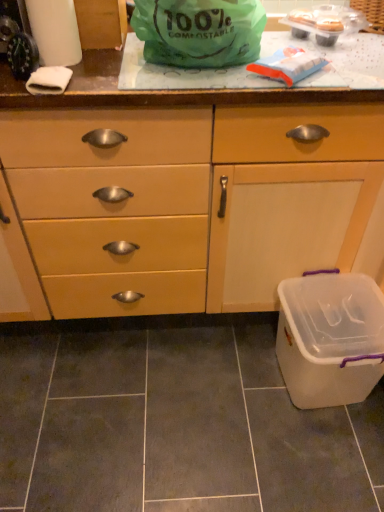
Locate an element on the screen. This screenshot has height=512, width=384. free point above white plastic container at lower right (from a real-world perspective) is located at coordinates (342, 328).